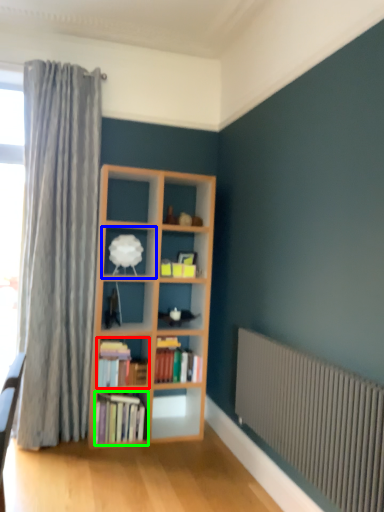
Question: Which object is the closest to the book (highlighted by a red box)? Choose among these: shelf (highlighted by a blue box) or book (highlighted by a green box).

Choices:
 (A) shelf
 (B) book

Answer: (B)